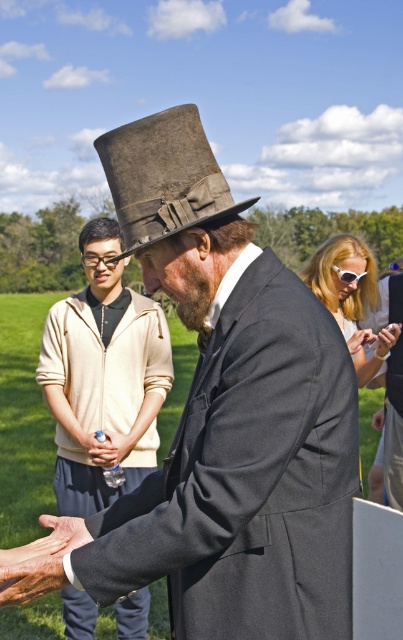
Question: Does dark brown felt fedora at upper center lie behind smooth skin hand at center?

Choices:
 (A) yes
 (B) no

Answer: (B)

Question: Which object is closer to the camera taking this photo?

Choices:
 (A) smooth skin hand at center
 (B) dry skin at lower left
 (C) black plastic goggles at center
 (D) white plastic goggles at center

Answer: (B)

Question: Which object appears farthest from the camera in this image?

Choices:
 (A) dry skin at lower left
 (B) light beige hoodie at center
 (C) dark brown felt fedora at upper center

Answer: (B)

Question: Does light beige hoodie at center appear on the right side of black plastic goggles at center?

Choices:
 (A) no
 (B) yes

Answer: (B)

Question: Does dry skin at lower left have a larger size compared to smooth skin hand at center?

Choices:
 (A) no
 (B) yes

Answer: (B)

Question: Which object appears closest to the camera in this image?

Choices:
 (A) dry skin at lower left
 (B) black plastic goggles at center
 (C) white plastic goggles at center
 (D) dark brown felt fedora at upper center

Answer: (D)